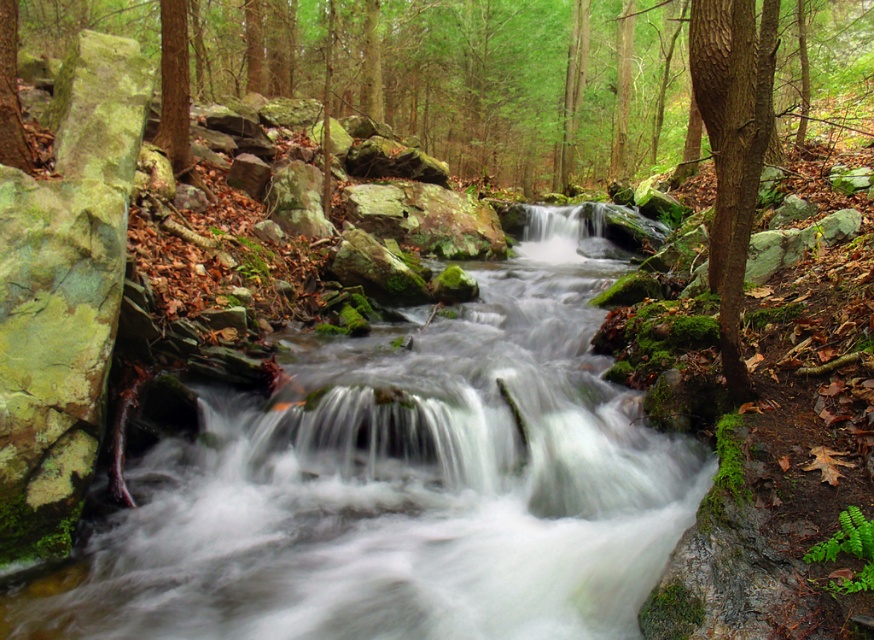
Question: Is clear water stream at center positioned in front of smooth bark tree at right?

Choices:
 (A) yes
 (B) no

Answer: (B)

Question: Which of the following is the farthest from the observer?

Choices:
 (A) (741, 384)
 (B) (490, 566)

Answer: (A)

Question: Which point is farther from the camera taking this photo?

Choices:
 (A) (500, 432)
 (B) (726, 125)

Answer: (A)

Question: Is clear water stream at center positioned at the back of smooth bark tree at right?

Choices:
 (A) yes
 (B) no

Answer: (A)

Question: In this image, where is clear water stream at center located relative to smooth bark tree at right?

Choices:
 (A) right
 (B) left

Answer: (B)